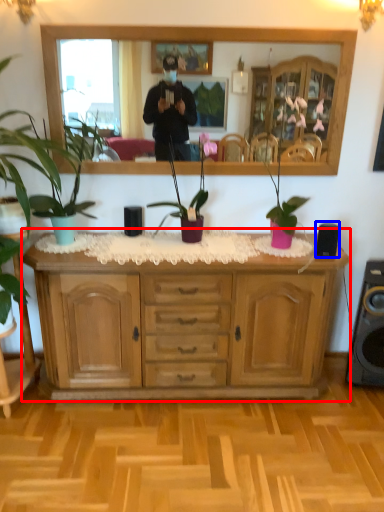
Question: Which object is further to the camera taking this photo, cabinetry (highlighted by a red box) or speaker (highlighted by a blue box)?

Choices:
 (A) cabinetry
 (B) speaker

Answer: (B)